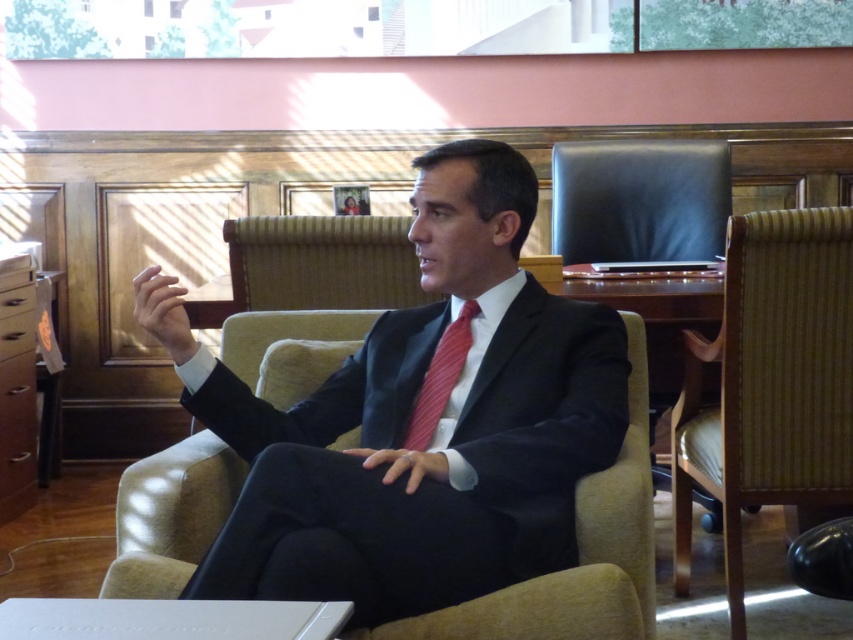
Question: Which object appears farthest from the camera in this image?

Choices:
 (A) dark blue suit at center
 (B) red striped tie at center

Answer: (B)

Question: Observing the image, what is the correct spatial positioning of woven fabric swivel chair at right in reference to red striped tie at center?

Choices:
 (A) left
 (B) right

Answer: (B)

Question: Is woven fabric swivel chair at right in front of red striped tie at center?

Choices:
 (A) yes
 (B) no

Answer: (B)

Question: From the image, what is the correct spatial relationship of dark blue suit at center in relation to red striped tie at center?

Choices:
 (A) below
 (B) above

Answer: (A)

Question: Considering the real-world distances, which object is closest to the dark blue suit at center?

Choices:
 (A) woven fabric swivel chair at right
 (B) red striped tie at center

Answer: (B)

Question: Which point is farther to the camera?

Choices:
 (A) pos(271,493)
 (B) pos(445,372)

Answer: (B)